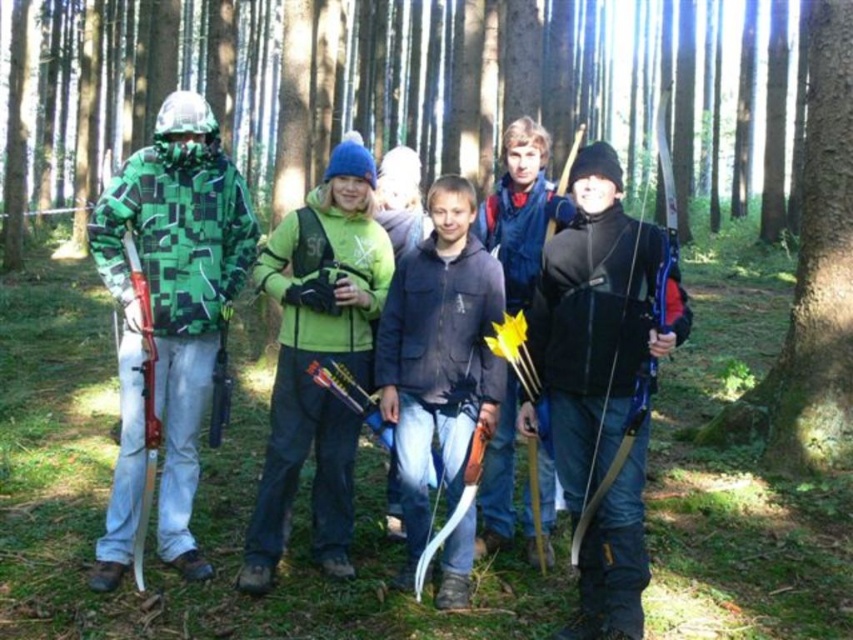
Which is above, green matte jacket at center or smooth bark tree at lower right?

smooth bark tree at lower right is above.

Is point (276, 497) positioned before point (785, 465)?

Yes, it is in front of point (785, 465).

At what (x,y) coordinates should I click in order to perform the action: click on green matte jacket at center. Please return your answer as a coordinate pair (x, y). Looking at the image, I should click on (318, 358).

Find the location of a particular element. The width and height of the screenshot is (853, 640). green matte jacket at center is located at coordinates (318, 358).

Is green pixelated jacket at left wider than green matte jacket at center?

Yes, green pixelated jacket at left is wider than green matte jacket at center.

Locate an element on the screen. green pixelated jacket at left is located at coordinates (169, 316).

At what (x,y) coordinates should I click in order to perform the action: click on green pixelated jacket at left. Please return your answer as a coordinate pair (x, y). Image resolution: width=853 pixels, height=640 pixels. Looking at the image, I should click on (169, 316).

What do you see at coordinates (602, 381) in the screenshot?
I see `matte black jacket at center` at bounding box center [602, 381].

Who is more distant from viewer, (582, 621) or (743, 435)?

The point (743, 435) is more distant.

I want to click on matte black jacket at center, so click(x=602, y=381).